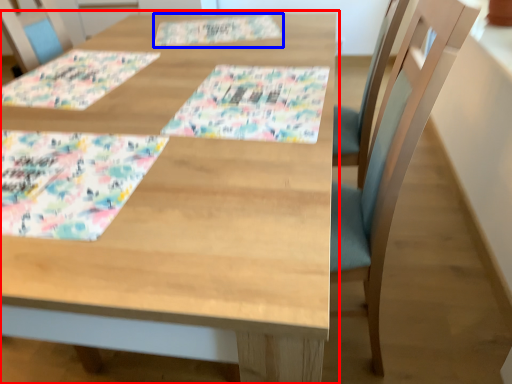
Question: Among these objects, which one is farthest to the camera, table (highlighted by a red box) or place mat (highlighted by a blue box)?

Choices:
 (A) table
 (B) place mat

Answer: (B)